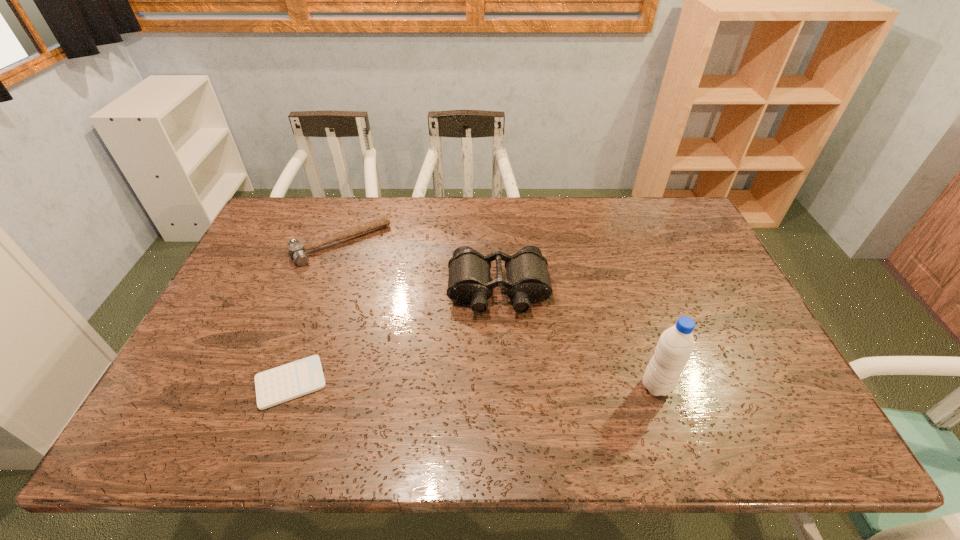
Identify the location of vacant space at the near edge. The height and width of the screenshot is (540, 960). (342, 381).

Locate an element on the screen. vacant space at the left edge of the desktop is located at coordinates (259, 274).

The height and width of the screenshot is (540, 960). In the image, there is a desktop. In order to click on free space at the right edge in this screenshot , I will do `click(676, 242)`.

You are a GUI agent. You are given a task and a screenshot of the screen. Output one action in this format:
    pyautogui.click(x=<x>, y=<y>)
    Task: Click on the free space at the far left corner
    The image size is (960, 540).
    Given the screenshot: What is the action you would take?
    pyautogui.click(x=294, y=217)

I want to click on free space at the far right corner, so click(x=690, y=235).

This screenshot has width=960, height=540. In the image, there is a desktop. Identify the location of vacant region at the near right corner. (746, 386).

Image resolution: width=960 pixels, height=540 pixels. In order to click on free space between the water bottle and the shortest object in this screenshot , I will do `click(473, 384)`.

Identify the location of unoccupied position between the third shortest object and the water bottle. (577, 339).

I want to click on unoccupied area between the hammer and the rightmost object, so click(498, 315).

The height and width of the screenshot is (540, 960). Find the location of `free spot between the second shortest object and the water bottle`. free spot between the second shortest object and the water bottle is located at coordinates (498, 315).